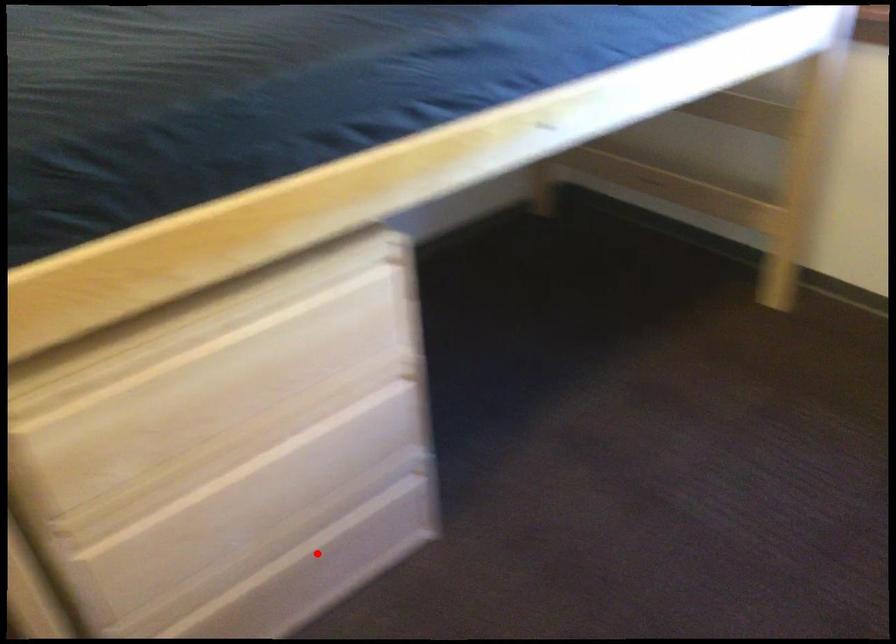
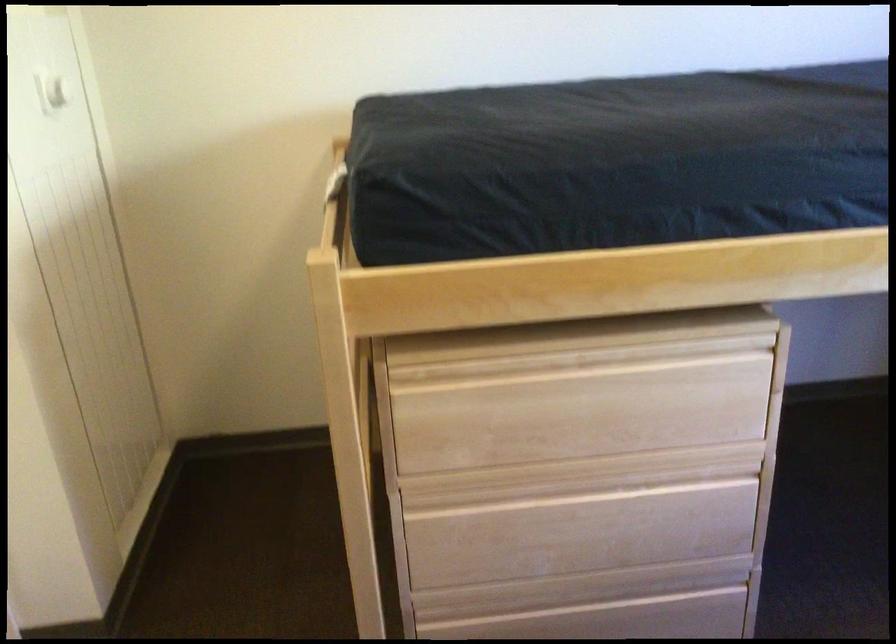
Find the pixel in the second image that matches the highlighted location in the first image.

(615, 619)